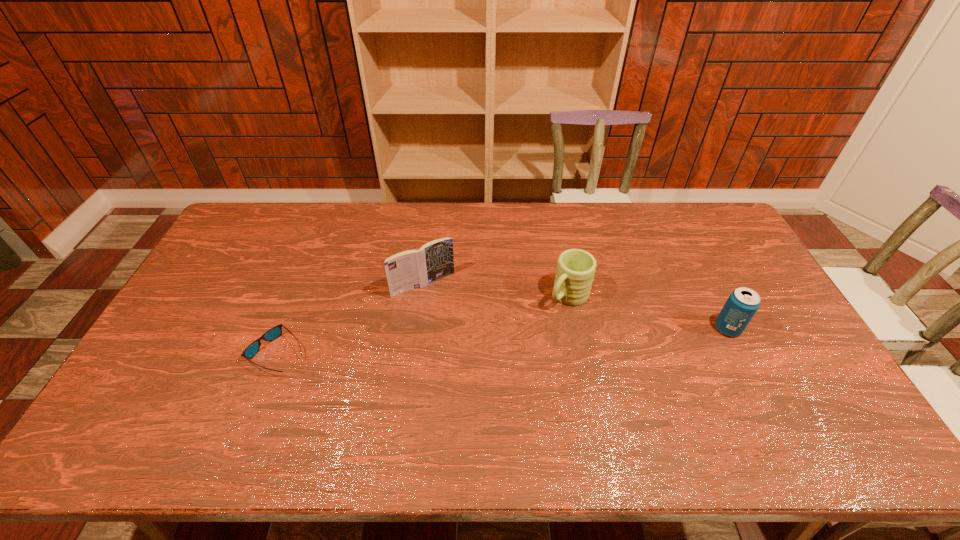
Image resolution: width=960 pixels, height=540 pixels. In order to click on the shortest object in this screenshot , I will do `click(275, 332)`.

Where is `the leftmost object`? the leftmost object is located at coordinates (275, 332).

Where is `soda can`? soda can is located at coordinates (742, 304).

The height and width of the screenshot is (540, 960). What are the coordinates of `the second object from left to right` in the screenshot? It's located at (412, 269).

Image resolution: width=960 pixels, height=540 pixels. Find the location of `the third object from left to right`. the third object from left to right is located at coordinates pyautogui.click(x=575, y=270).

This screenshot has height=540, width=960. Find the location of `free space located 0.180m at the front of the shortest object showing the lenses`. free space located 0.180m at the front of the shortest object showing the lenses is located at coordinates (186, 354).

At what (x,y) coordinates should I click in order to perform the action: click on blank space located 0.050m at the front of the shortest object showing the lenses. Please return your answer as a coordinate pair (x, y). This screenshot has width=960, height=540. Looking at the image, I should click on (232, 354).

Locate an element on the screen. The height and width of the screenshot is (540, 960). vacant position located 0.260m at the front of the shortest object showing the lenses is located at coordinates (157, 354).

Where is `free space located 0.290m on the left of the soda can`? free space located 0.290m on the left of the soda can is located at coordinates (616, 328).

Where is `free region located 0.070m on the front cover of the third object from right to left`? This screenshot has height=540, width=960. free region located 0.070m on the front cover of the third object from right to left is located at coordinates pyautogui.click(x=447, y=312).